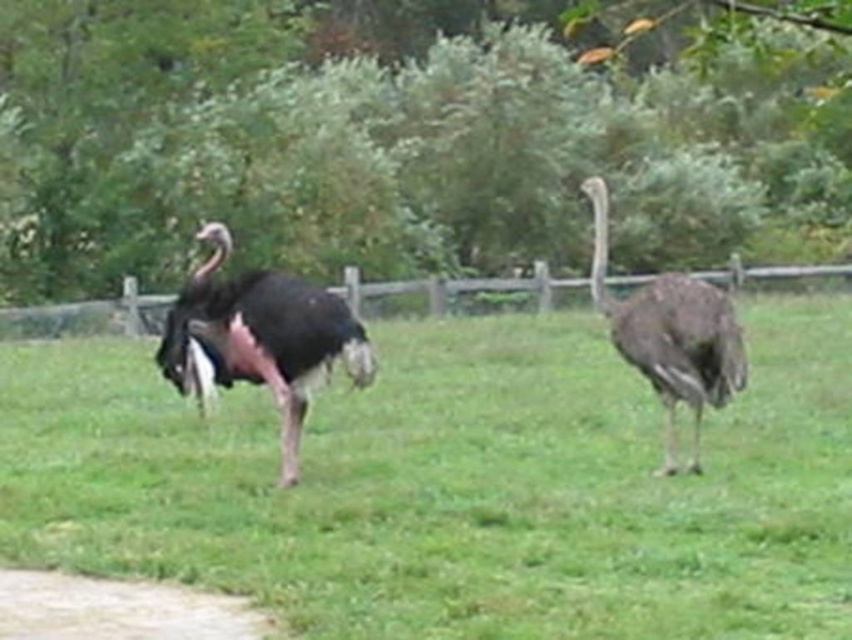
Between green grassy at center and dark brown feathers at center, which one appears on the right side from the viewer's perspective?

dark brown feathers at center is more to the right.

Is green grassy at center thinner than dark brown feathers at center?

No, green grassy at center is not thinner than dark brown feathers at center.

Who is more distant from viewer, (724, 573) or (718, 305)?

The point (718, 305) is more distant.

Identify the location of green grassy at center. (453, 483).

Consider the image. Is dark brown feathers at center positioned in front of dirt path at lower left?

No.

Is point (649, 340) in front of point (33, 598)?

That is False.

This screenshot has width=852, height=640. What do you see at coordinates (671, 336) in the screenshot? I see `dark brown feathers at center` at bounding box center [671, 336].

Where is `dark brown feathers at center`? dark brown feathers at center is located at coordinates (671, 336).

Locate an element on the screen. The width and height of the screenshot is (852, 640). dark brown feathers at left is located at coordinates (258, 339).

In the scene shown: Is dark brown feathers at left taller than dirt path at lower left?

Indeed, dark brown feathers at left has a greater height compared to dirt path at lower left.

Where is `dark brown feathers at left`? The image size is (852, 640). dark brown feathers at left is located at coordinates (258, 339).